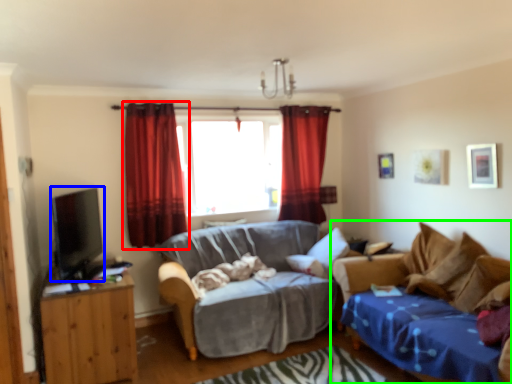
Question: Which object is the closest to the curtain (highlighted by a red box)? Choose among these: open (highlighted by a blue box) or studio couch (highlighted by a green box).

Choices:
 (A) open
 (B) studio couch

Answer: (A)